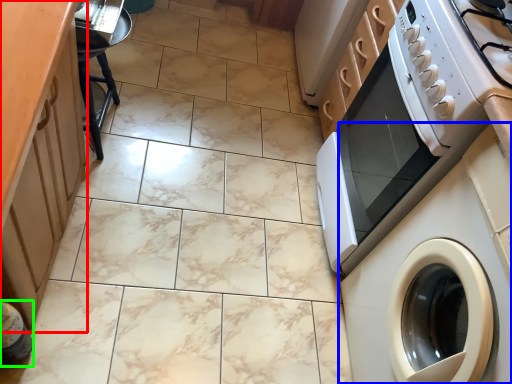
Question: Which is farther away from cabinetry (highlighted by a red box)? washing machine (highlighted by a blue box) or bottle (highlighted by a green box)?

Choices:
 (A) washing machine
 (B) bottle

Answer: (A)